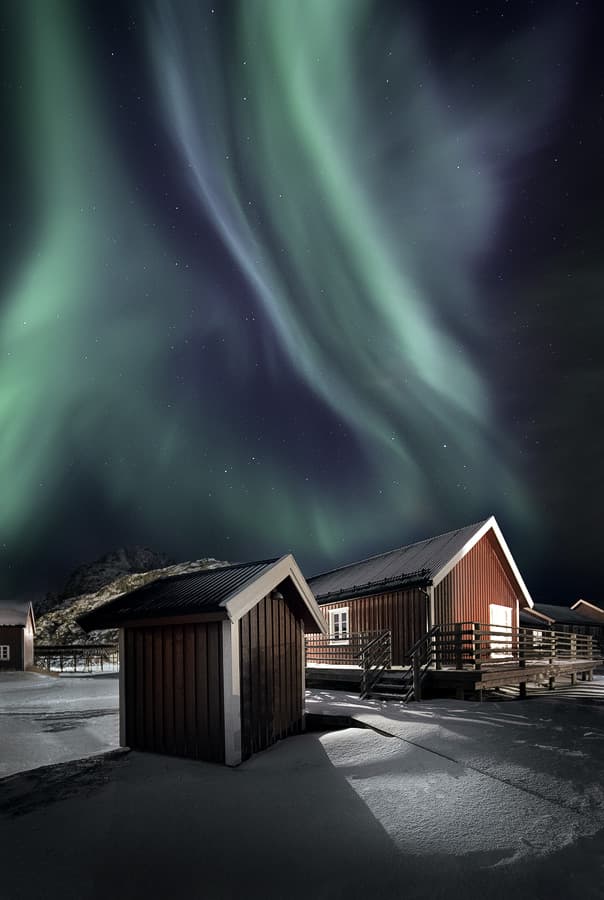
Identify the location of side door. [x=498, y=618].